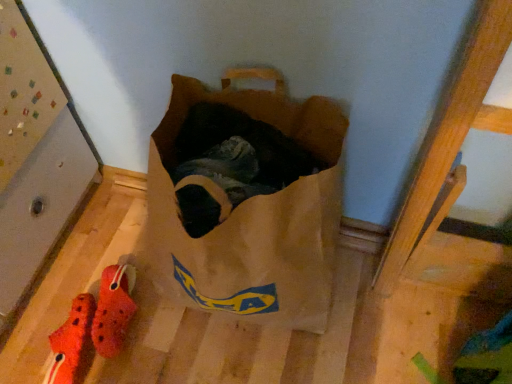
Question: Can you confirm if orange fabric slipper at lower left, acting as the second footwear starting from the right, is bigger than rubberized red croc at lower left, positioned as the first footwear in right-to-left order?

Choices:
 (A) no
 (B) yes

Answer: (B)

Question: Can you confirm if orange fabric slipper at lower left, acting as the second footwear starting from the right, is taller than rubberized red croc at lower left, positioned as the first footwear in right-to-left order?

Choices:
 (A) yes
 (B) no

Answer: (A)

Question: Is the depth of orange fabric slipper at lower left, the first footwear viewed from the left, greater than that of rubberized red croc at lower left, positioned as the first footwear in right-to-left order?

Choices:
 (A) yes
 (B) no

Answer: (B)

Question: Is orange fabric slipper at lower left, the first footwear viewed from the left, to the left of rubberized red croc at lower left, arranged as the second footwear when viewed from the left, from the viewer's perspective?

Choices:
 (A) no
 (B) yes

Answer: (B)

Question: Is orange fabric slipper at lower left, the first footwear viewed from the left, to the right of rubberized red croc at lower left, arranged as the second footwear when viewed from the left, from the viewer's perspective?

Choices:
 (A) no
 (B) yes

Answer: (A)

Question: Is the depth of orange fabric slipper at lower left, acting as the second footwear starting from the right, less than that of rubberized red croc at lower left, arranged as the second footwear when viewed from the left?

Choices:
 (A) no
 (B) yes

Answer: (B)

Question: Is rubberized red croc at lower left, positioned as the first footwear in right-to-left order, taller than orange fabric slipper at lower left, the first footwear viewed from the left?

Choices:
 (A) yes
 (B) no

Answer: (B)

Question: Can you confirm if rubberized red croc at lower left, arranged as the second footwear when viewed from the left, is bigger than orange fabric slipper at lower left, acting as the second footwear starting from the right?

Choices:
 (A) no
 (B) yes

Answer: (A)

Question: Can you confirm if rubberized red croc at lower left, arranged as the second footwear when viewed from the left, is smaller than orange fabric slipper at lower left, acting as the second footwear starting from the right?

Choices:
 (A) yes
 (B) no

Answer: (A)

Question: Does rubberized red croc at lower left, arranged as the second footwear when viewed from the left, have a lesser width compared to orange fabric slipper at lower left, the first footwear viewed from the left?

Choices:
 (A) no
 (B) yes

Answer: (A)

Question: Does rubberized red croc at lower left, positioned as the first footwear in right-to-left order, have a lesser height compared to orange fabric slipper at lower left, acting as the second footwear starting from the right?

Choices:
 (A) no
 (B) yes

Answer: (B)

Question: Is rubberized red croc at lower left, positioned as the first footwear in right-to-left order, further to camera compared to orange fabric slipper at lower left, acting as the second footwear starting from the right?

Choices:
 (A) yes
 (B) no

Answer: (A)

Question: From a real-world perspective, is orange fabric slipper at lower left, acting as the second footwear starting from the right, above or below rubberized red croc at lower left, arranged as the second footwear when viewed from the left?

Choices:
 (A) above
 (B) below

Answer: (B)